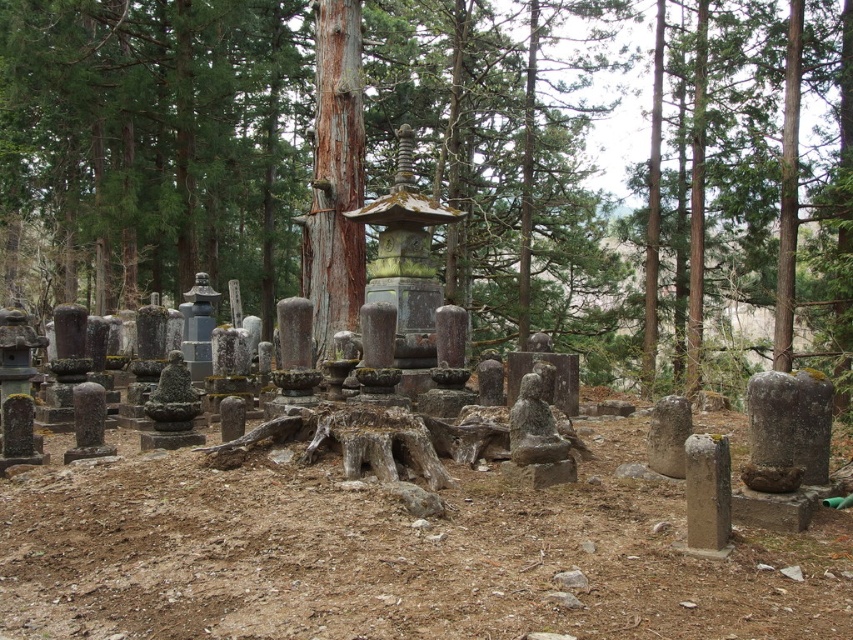
Looking at this image, does green mossy tree trunk at center have a greater width compared to smooth brown bark at center?

Indeed, green mossy tree trunk at center has a greater width compared to smooth brown bark at center.

Can you confirm if green mossy tree trunk at center is smaller than smooth brown bark at center?

Incorrect, green mossy tree trunk at center is not smaller in size than smooth brown bark at center.

Which is in front, point (817, 12) or point (346, 300)?

Positioned in front is point (346, 300).

Locate an element on the screen. The height and width of the screenshot is (640, 853). green mossy tree trunk at center is located at coordinates (413, 156).